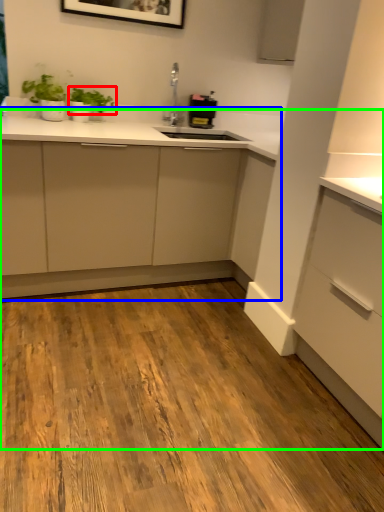
Question: Considering the real-world distances, which object is closest to plant (highlighted by a red box)? cabinetry (highlighted by a blue box) or dresser (highlighted by a green box).

Choices:
 (A) cabinetry
 (B) dresser

Answer: (B)